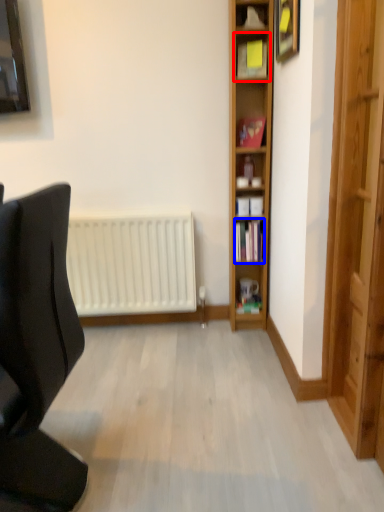
Question: Which object appears farthest to the camera in this image, shelf (highlighted by a red box) or book (highlighted by a blue box)?

Choices:
 (A) shelf
 (B) book

Answer: (B)